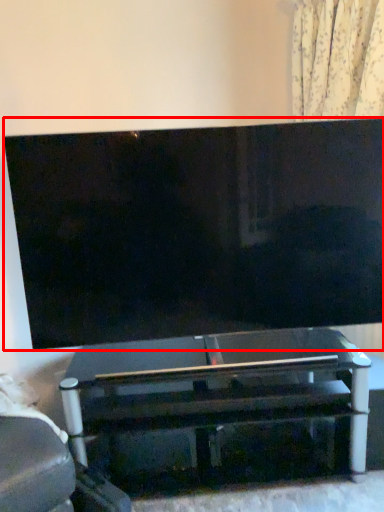
Question: Where is television (annotated by the red box) located in relation to table in the image?

Choices:
 (A) left
 (B) right

Answer: (A)